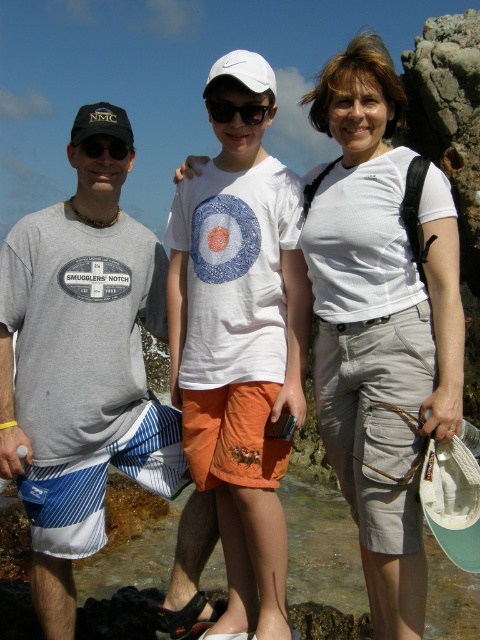
Question: Which of the following is the farthest from the observer?

Choices:
 (A) (162, 520)
 (B) (245, 80)
 (C) (93, 152)

Answer: (A)

Question: Does white matte shirt at center appear on the left side of black plastic goggles at center?

Choices:
 (A) no
 (B) yes

Answer: (A)

Question: Which of the following is the farthest from the observer?

Choices:
 (A) click(225, 362)
 (B) click(143, 476)
 (C) click(312, 257)

Answer: (B)

Question: Does white matte shirt at center have a lesser width compared to white matte baseball cap at center?

Choices:
 (A) yes
 (B) no

Answer: (B)

Question: Among these objects, which one is nearest to the camera?

Choices:
 (A) white matte shirt at center
 (B) gray cotton t-shirt at left
 (C) matte black goggles at left
 (D) white matte baseball cap at center

Answer: (A)

Question: Observing the image, what is the correct spatial positioning of white matte shirt at center in reference to matte black baseball cap at left?

Choices:
 (A) right
 (B) left

Answer: (A)